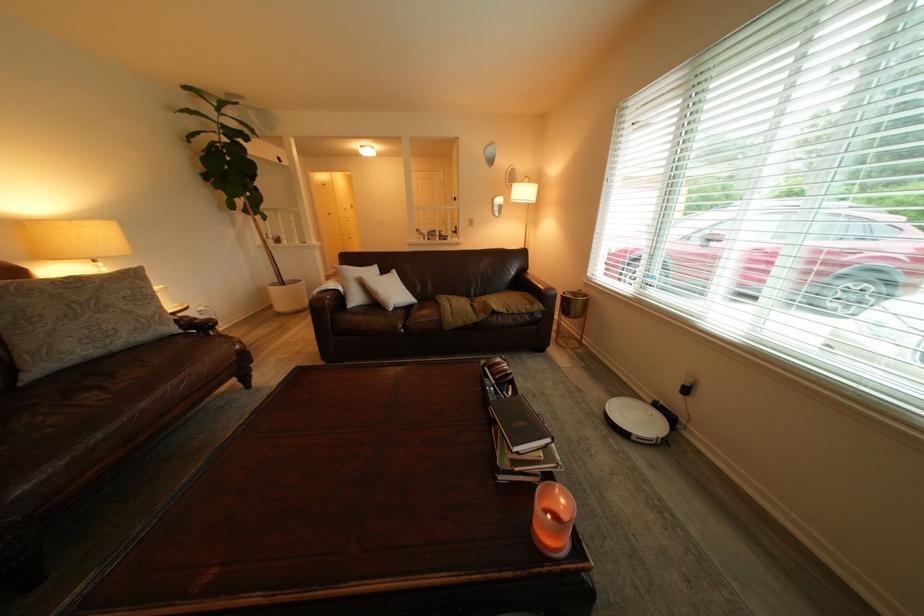
This screenshot has width=924, height=616. What are the coordinates of `orange glass candle` in the screenshot? It's located at (553, 519).